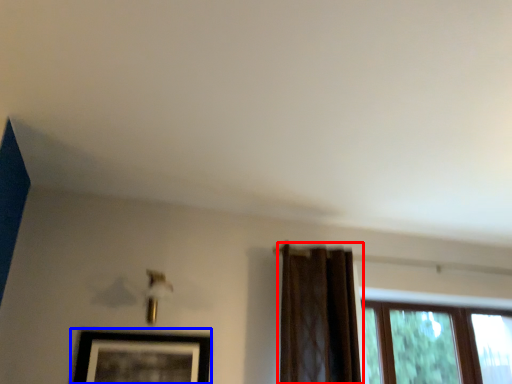
Question: Which point is further to the camera, curtain (highlighted by a red box) or picture frame (highlighted by a blue box)?

Choices:
 (A) curtain
 (B) picture frame

Answer: (A)